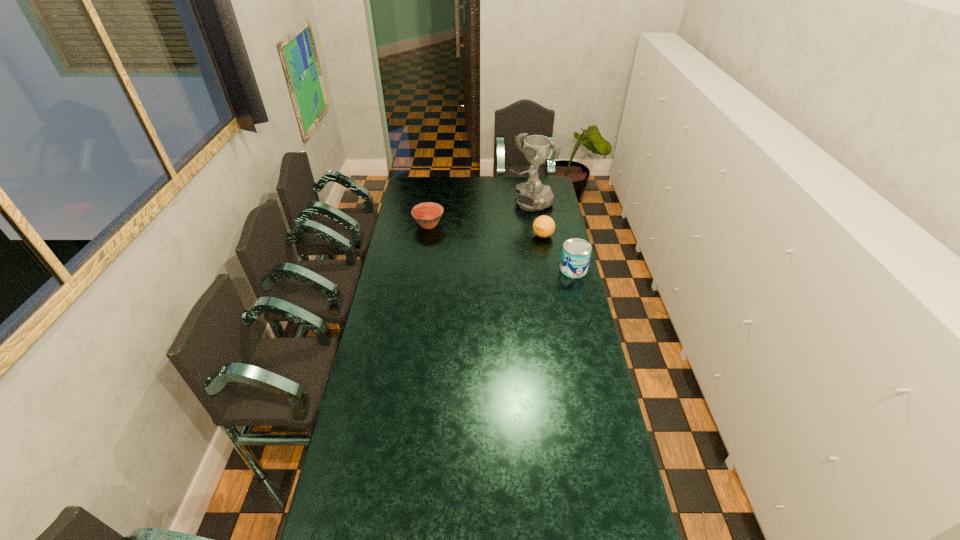
The width and height of the screenshot is (960, 540). In order to click on vacant space located on the side with emblem of the tallest object in this screenshot , I will do `click(502, 226)`.

Where is `vacant space situated on the side with emblem of the tallest object`? The height and width of the screenshot is (540, 960). vacant space situated on the side with emblem of the tallest object is located at coordinates (493, 234).

Where is `free space located on the side with brand of the second shortest object`? This screenshot has height=540, width=960. free space located on the side with brand of the second shortest object is located at coordinates (483, 264).

The width and height of the screenshot is (960, 540). What are the coordinates of `vacant space located 0.350m on the side with brand of the second shortest object` in the screenshot? It's located at (481, 265).

In order to click on vacant space situated on the side with brand of the second shortest object in this screenshot , I will do `click(497, 257)`.

The image size is (960, 540). I want to click on object positioned at the far edge, so click(x=532, y=195).

Where is `object situated at the left edge`? This screenshot has width=960, height=540. object situated at the left edge is located at coordinates (427, 214).

This screenshot has width=960, height=540. I want to click on can present at the right edge, so click(x=576, y=252).

Where is `award located in the right edge section of the desktop`? award located in the right edge section of the desktop is located at coordinates (532, 195).

Find the location of a particular element. This screenshot has width=960, height=540. ping-pong ball that is at the right edge is located at coordinates (543, 226).